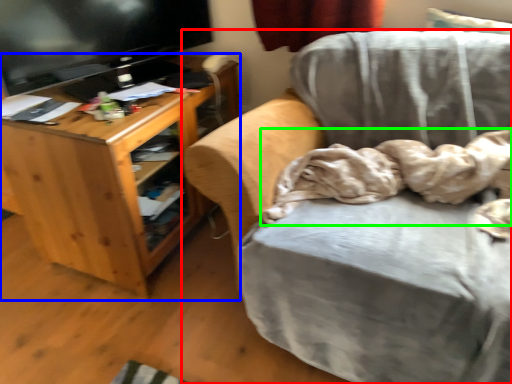
Question: Which is farther away from chair (highlighted by a red box)? desk (highlighted by a blue box) or blanket (highlighted by a green box)?

Choices:
 (A) desk
 (B) blanket

Answer: (A)